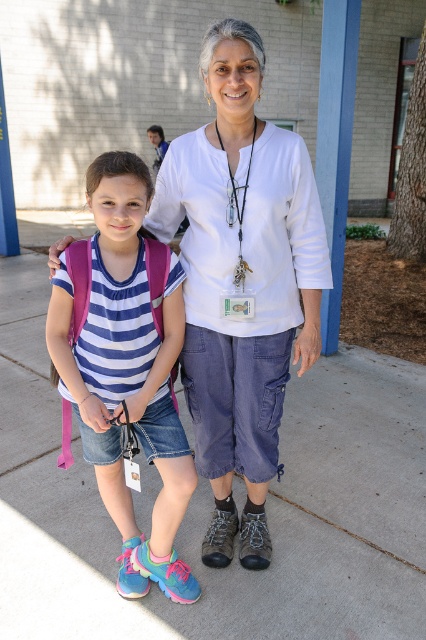
Question: Can you confirm if gray concrete pavement at center is positioned to the left of blue striped shirt at center?

Choices:
 (A) no
 (B) yes

Answer: (A)

Question: Among these objects, which one is nearest to the camera?

Choices:
 (A) blue striped shirt at center
 (B) white cotton shirt at center
 (C) gray concrete pavement at center

Answer: (A)

Question: Which point is farther to the camera?

Choices:
 (A) blue striped shirt at center
 (B) white cotton shirt at center

Answer: (B)

Question: Does gray concrete pavement at center have a smaller size compared to blue striped shirt at center?

Choices:
 (A) yes
 (B) no

Answer: (B)

Question: Among these points, which one is nearest to the camera?

Choices:
 (A) (108, 538)
 (B) (290, 324)

Answer: (B)

Question: Can you confirm if white cotton shirt at center is positioned below blue striped shirt at center?

Choices:
 (A) yes
 (B) no

Answer: (B)